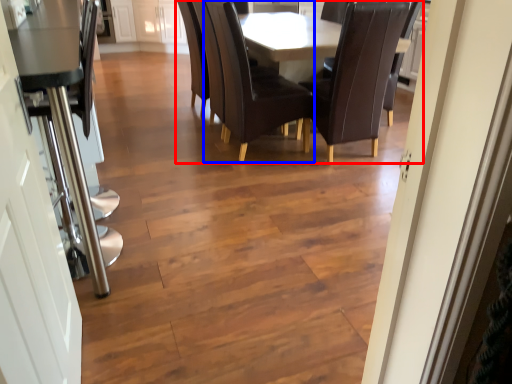
Question: Which of the following is the farthest to the observer, kitchen & dining room table (highlighted by a red box) or chair (highlighted by a blue box)?

Choices:
 (A) kitchen & dining room table
 (B) chair

Answer: (A)